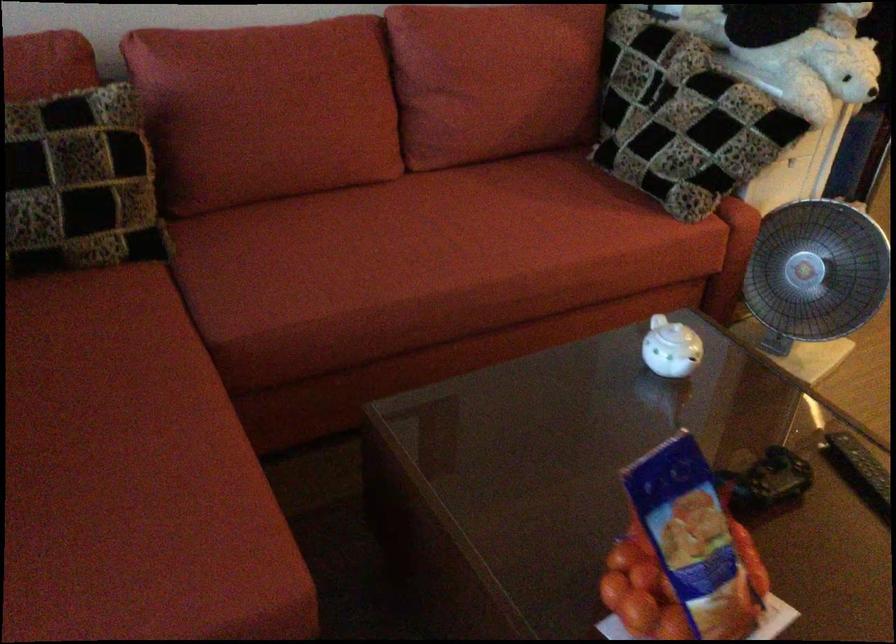
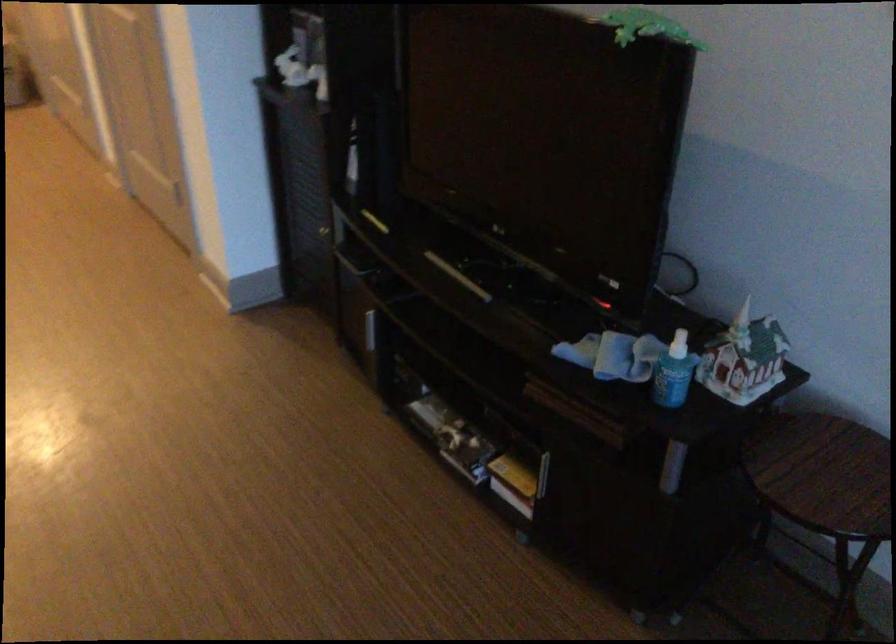
Based on the continuous images, in which direction is the camera rotating?

The camera rotated toward right-down.